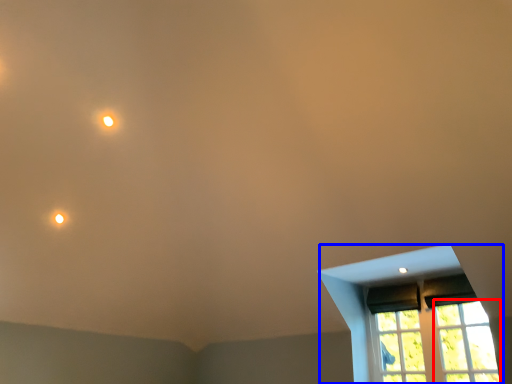
Question: Which point is further to the camera, glass window (highlighted by a red box) or window (highlighted by a blue box)?

Choices:
 (A) glass window
 (B) window

Answer: (B)